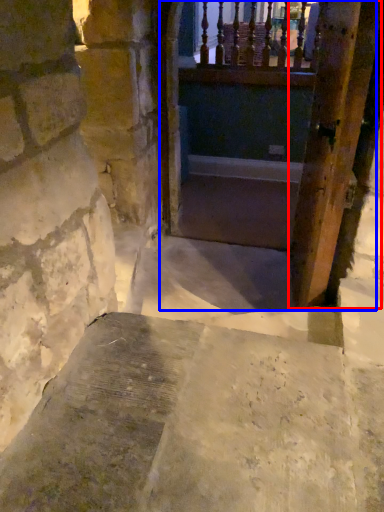
Question: Which of the following is the closest to the observer, door (highlighted by a red box) or tunnel (highlighted by a blue box)?

Choices:
 (A) door
 (B) tunnel

Answer: (A)